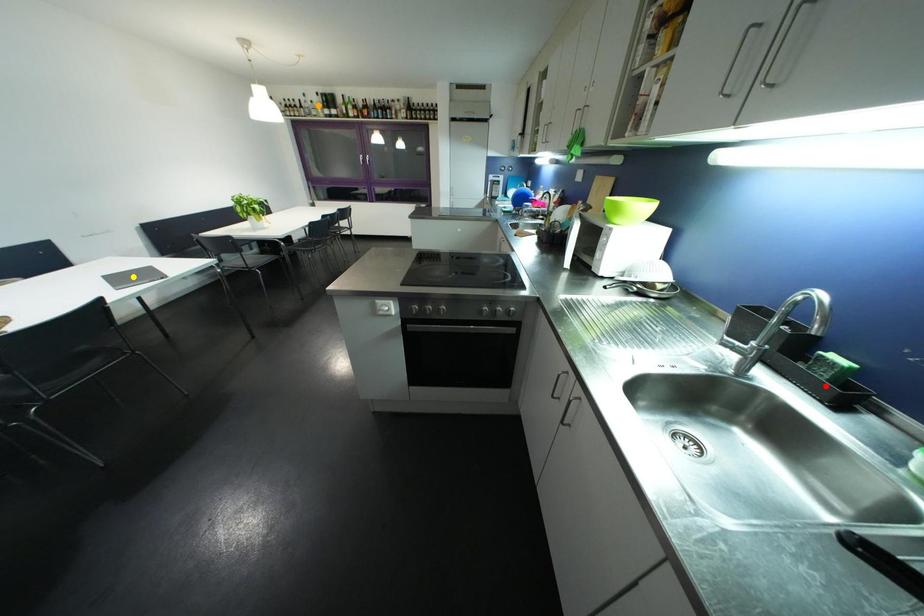
Order these from nearest to farthest:
1. orange point
2. yellow point
3. red point

red point
yellow point
orange point